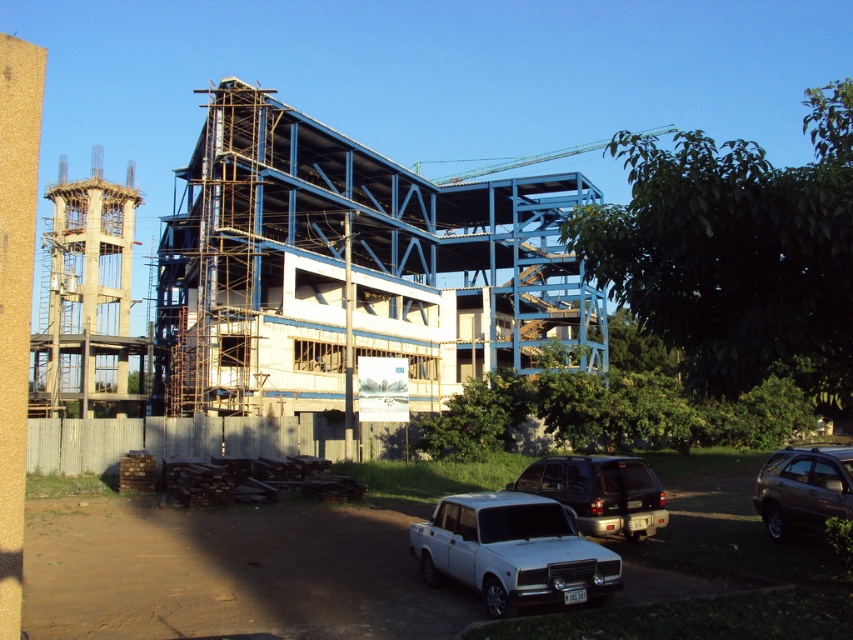
You are a delivery driver who needs to park your truck between the matte black suv at center and the dark brown metallic suv at lower right. Can you fit your truck, which is 2 meters wide, in the space between them?

The matte black suv at center is shorter than the dark brown metallic suv at lower right, but the description does not provide the exact distance between them. Without knowing the width of the space, it is impossible to determine if the truck can fit.

From the picture: You are a delivery driver who needs to park your vehicle in the construction site. You see the matte black suv at center and the dark brown metallic suv at lower right. Which vehicle is parked closer to the fence enclosing the site?

The dark brown metallic suv at lower right is closer to the fence enclosing the site because the matte black suv at center is positioned under it, indicating it is located further inward from the fence.